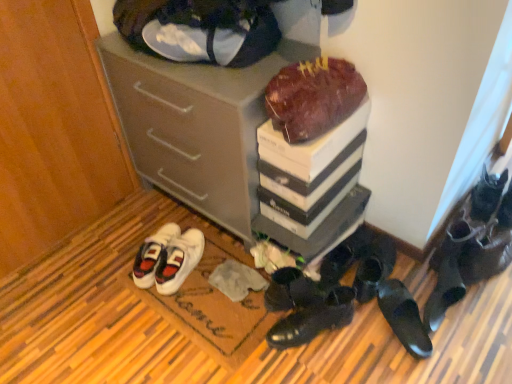
Where is `free point above black leather shoes at lower right, the fourth footwear viewed from the left (from a real-world perspective)`? free point above black leather shoes at lower right, the fourth footwear viewed from the left (from a real-world perspective) is located at coordinates (350, 240).